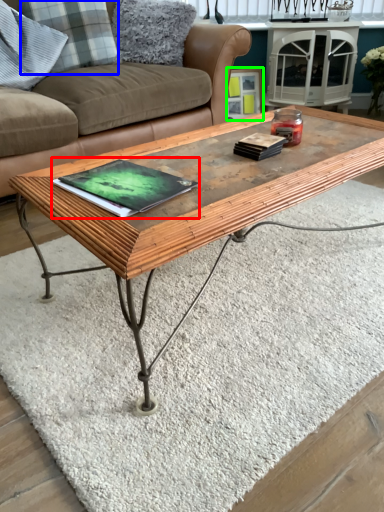
Question: Which is nearer to the book (highlighted by a red box)? pillow (highlighted by a blue box) or picture frame (highlighted by a green box).

Choices:
 (A) pillow
 (B) picture frame

Answer: (A)